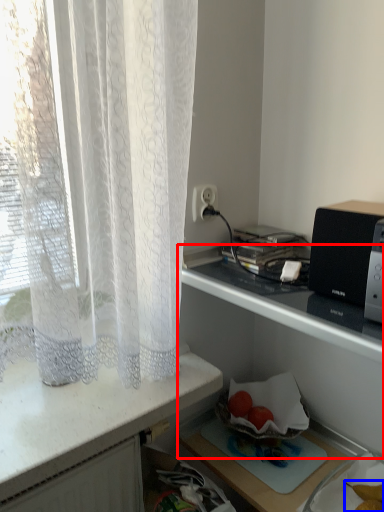
Question: Which of the following is the farthest to the observer, shelf (highlighted by a red box) or food (highlighted by a blue box)?

Choices:
 (A) shelf
 (B) food

Answer: (B)